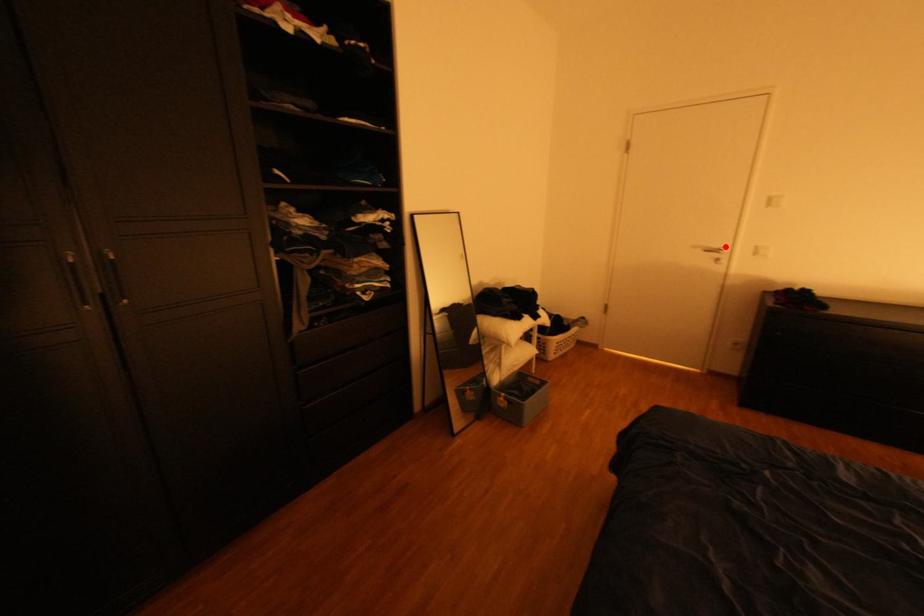
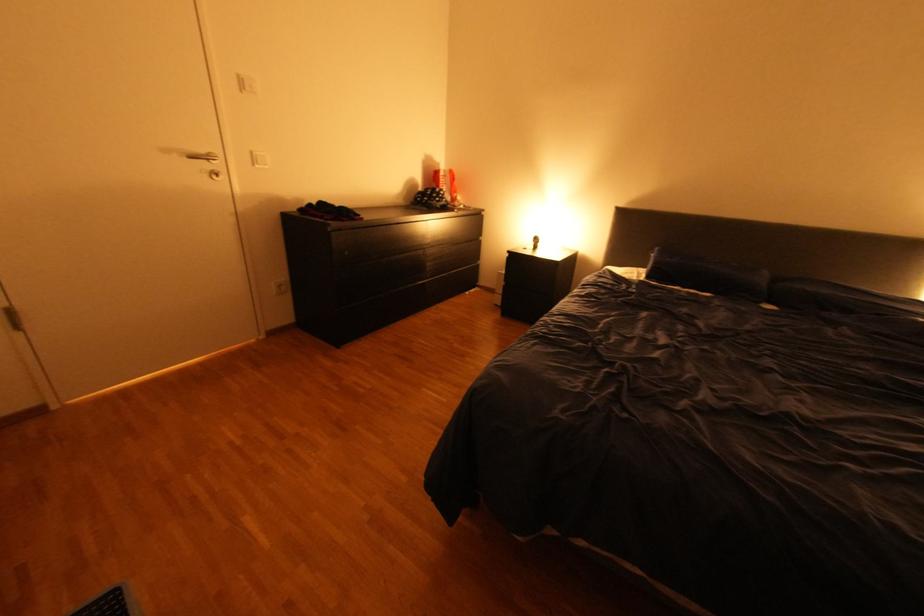
In the second image, find the point that corresponds to the highlighted location in the first image.

(213, 151)